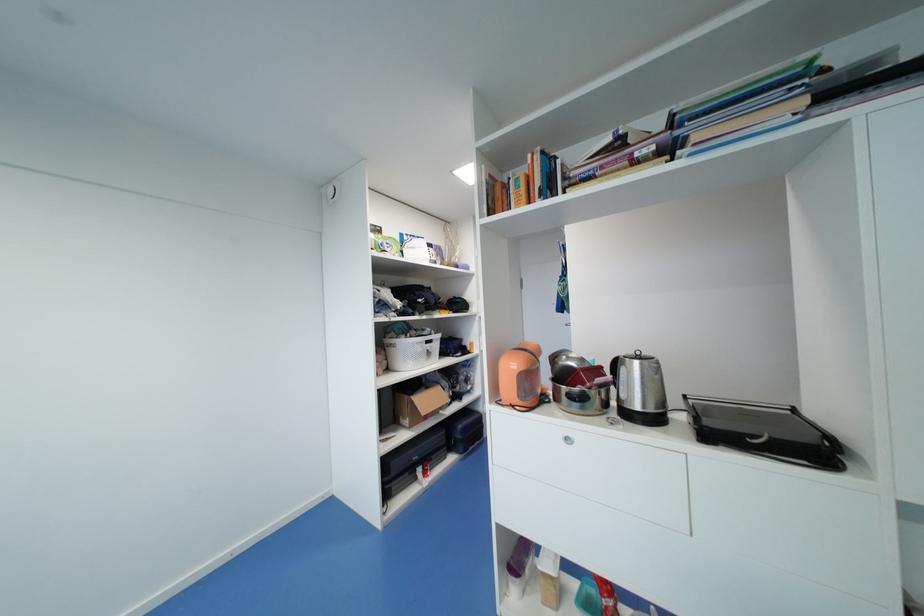
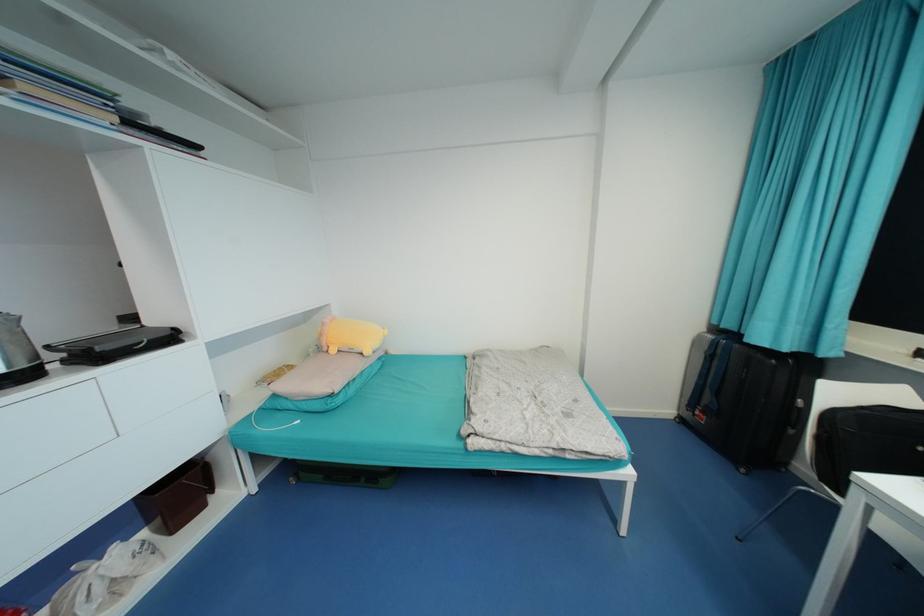
The point at (834, 440) is marked in the first image. Where is the corresponding point in the second image?

(179, 330)